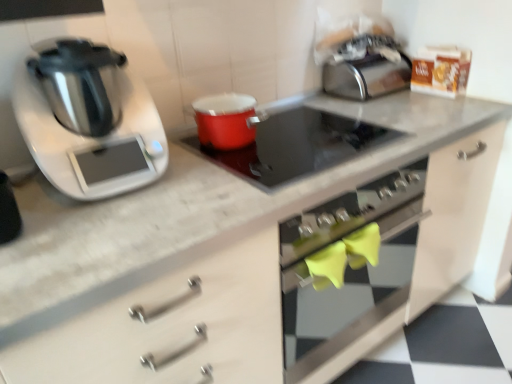
The height and width of the screenshot is (384, 512). Identify the location of unoccupied area in front of matte red pot at center. (192, 168).